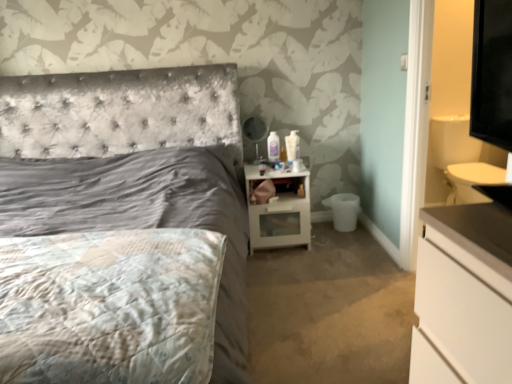
Locate an element on the screen. The image size is (512, 384). vacant area on top of white glossy nightstand at center (from a real-world perspective) is located at coordinates (273, 165).